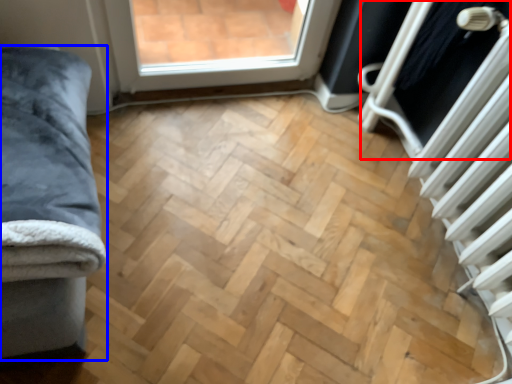
Question: Among these objects, which one is farthest to the camera, screen door (highlighted by a red box) or furniture (highlighted by a blue box)?

Choices:
 (A) screen door
 (B) furniture

Answer: (A)